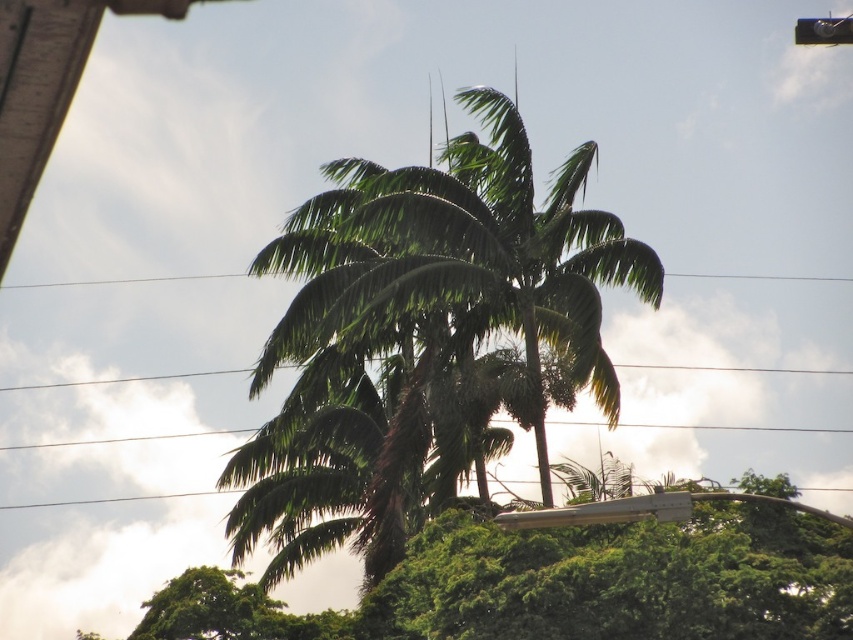
This screenshot has width=853, height=640. Describe the element at coordinates (425, 321) in the screenshot. I see `green leafy coconut tree at center` at that location.

Is point (390, 561) behind point (257, 611)?

No.

You are a GUI agent. You are given a task and a screenshot of the screen. Output one action in this format:
    pyautogui.click(x=<x>, y=<y>)
    Task: Click on the green leafy coconut tree at center
    Image resolution: width=853 pixels, height=640 pixels.
    Given the screenshot: What is the action you would take?
    pyautogui.click(x=425, y=321)